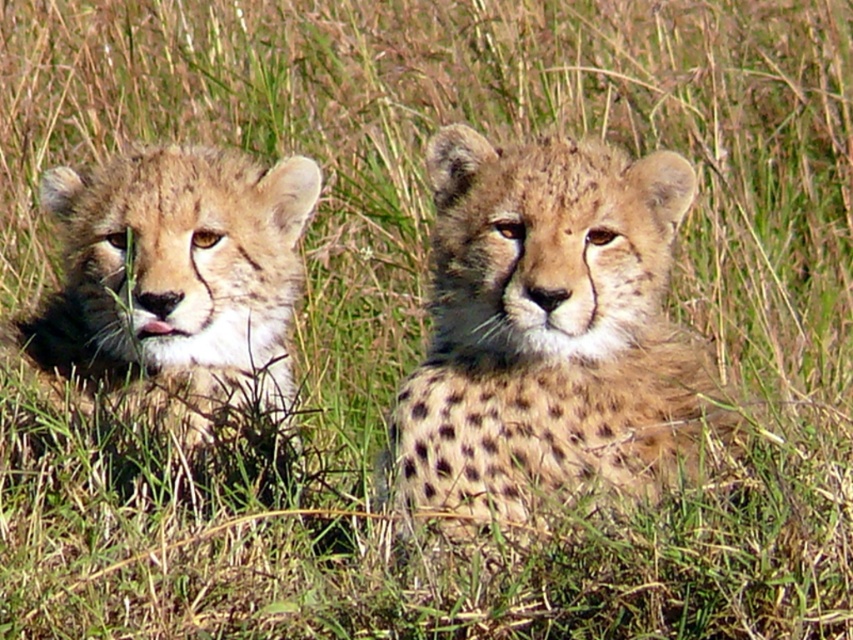
You are observing two spotted fur cheetahs in a grassy savanna. The spotted fur cheetah at center and the spotted fur cheetah at left are both present. Which cheetah is positioned to the right of the other?

The spotted fur cheetah at center is positioned on the right side of the spotted fur cheetah at left.

You are a wildlife photographer trying to capture a closeup of the spotted fur cheetah at center and the spotted fur cheetah at left. If your camera can only focus on one cheetah at a time, which cheetah should you focus on to ensure the closest possible focus given their sizes?

The spotted fur cheetah at center has a smaller width than the spotted fur cheetah at left, so focusing on the spotted fur cheetah at center would allow for a closer focus due to its smaller size.

You are a wildlife photographer aiming to capture a closeup of the spotted fur cheetah at center. You are currently positioned at point [547,330]. Can you get a clear shot of the spotted fur cheetah at center from your current position?

Yes, you can get a clear shot of the spotted fur cheetah at center from your current position at point [547,330] since that is exactly where the cheetah is located.